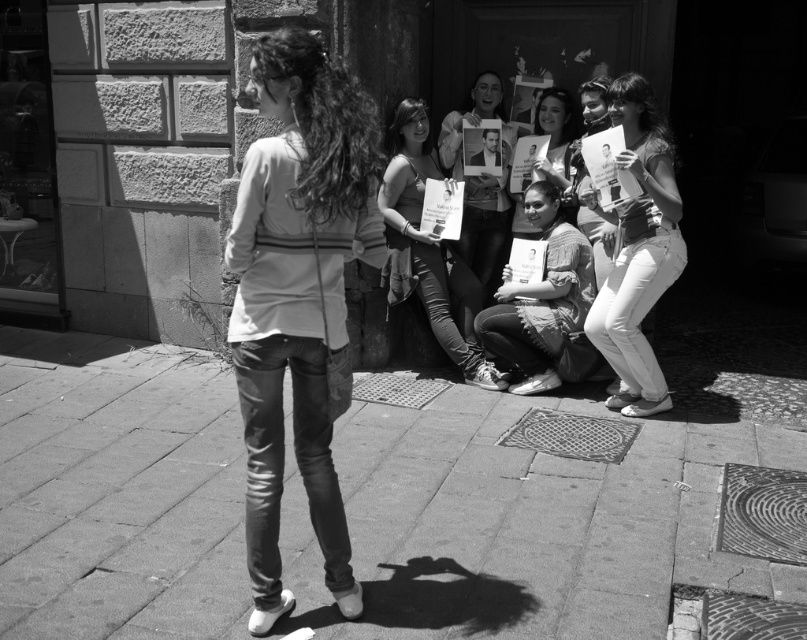
You are standing at the point with coordinates point (448, 152) and want to move to the point with coordinates point (647, 364). Is the destination point in front of or behind you?

The destination point with coordinates point (647, 364) is in front of you since it is in front of point (448, 152).

You are a photographer trying to capture a clear shot of both the matte gray sweater at center and the smooth fabric poster at center. Which object is positioned lower in the frame?

The matte gray sweater at center is positioned below the smooth fabric poster at center, so it is lower in the frame.

You are a photographer trying to adjust the focus on your camera. You want to ensure both the white denim jeans at right and the matte fabric shirt at center are in focus. Given their distance apart, do you think adjusting the focus to the midpoint between them would work?

The white denim jeans at right and matte fabric shirt at center are 20.86 inches apart from each other. Adjusting the focus to the midpoint between them should work because the distance is manageable for the camera to capture both in focus.